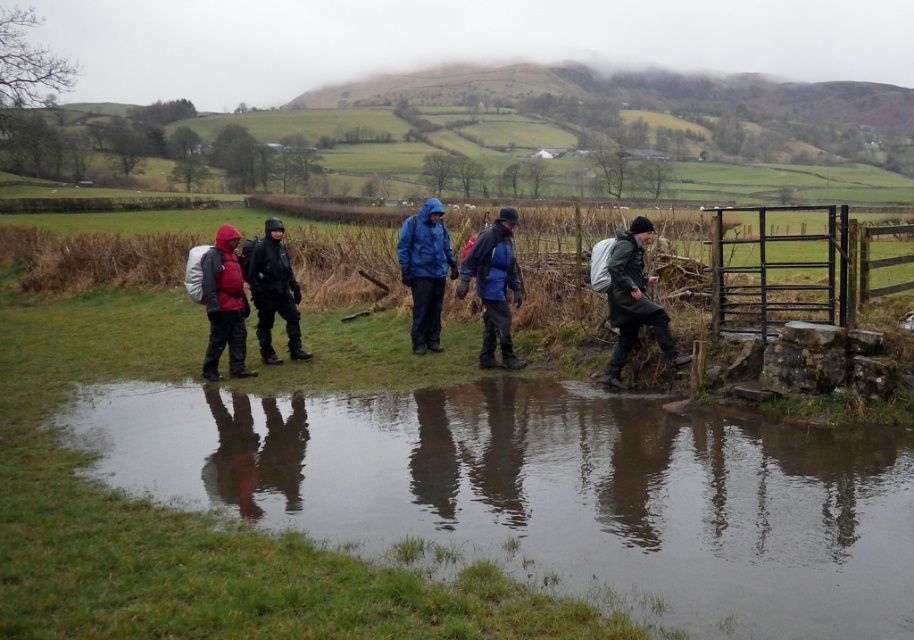
You are a hiker trying to identify the position of the two jackets in the group. Which jacket is closer to you, the observer, the matte blue jacket at center or the matte red jacket at left?

The matte blue jacket at center is closer to you because the matte red jacket at left is positioned behind it.